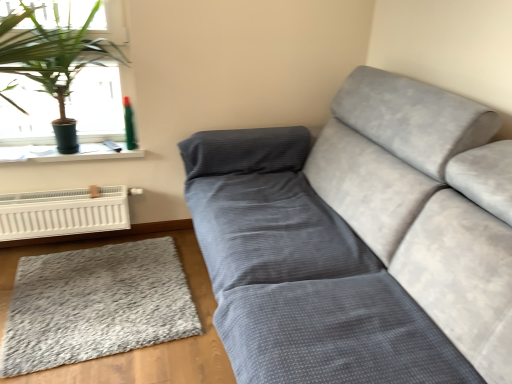
Question: Considering the relative positions of teal plastic spray can at upper left and green leafy plant at upper left in the image provided, is teal plastic spray can at upper left to the right of green leafy plant at upper left from the viewer's perspective?

Choices:
 (A) no
 (B) yes

Answer: (B)

Question: Does teal plastic spray can at upper left have a lesser height compared to green leafy plant at upper left?

Choices:
 (A) yes
 (B) no

Answer: (A)

Question: Is teal plastic spray can at upper left not inside green leafy plant at upper left?

Choices:
 (A) no
 (B) yes

Answer: (A)

Question: From a real-world perspective, is teal plastic spray can at upper left located higher than green leafy plant at upper left?

Choices:
 (A) yes
 (B) no

Answer: (B)

Question: Is teal plastic spray can at upper left oriented away from green leafy plant at upper left?

Choices:
 (A) yes
 (B) no

Answer: (A)

Question: Is gray shaggy rug at lower left taller or shorter than green leafy plant at upper left?

Choices:
 (A) short
 (B) tall

Answer: (A)

Question: Is point (7, 321) closer or farther from the camera than point (58, 84)?

Choices:
 (A) closer
 (B) farther

Answer: (A)

Question: Looking at their shapes, would you say gray shaggy rug at lower left is wider or thinner than green leafy plant at upper left?

Choices:
 (A) wide
 (B) thin

Answer: (A)

Question: Do you think gray shaggy rug at lower left is within green leafy plant at upper left, or outside of it?

Choices:
 (A) outside
 (B) inside

Answer: (A)

Question: Relative to gray shaggy rug at lower left, is teal plastic spray can at upper left in front or behind?

Choices:
 (A) behind
 (B) front

Answer: (A)

Question: Is teal plastic spray can at upper left to the left or to the right of gray shaggy rug at lower left in the image?

Choices:
 (A) left
 (B) right

Answer: (B)

Question: Looking at the image, does teal plastic spray can at upper left seem bigger or smaller compared to gray shaggy rug at lower left?

Choices:
 (A) big
 (B) small

Answer: (B)

Question: In terms of width, does teal plastic spray can at upper left look wider or thinner when compared to gray shaggy rug at lower left?

Choices:
 (A) thin
 (B) wide

Answer: (A)

Question: Visually, is white plastic heater at lower left positioned to the left or to the right of green leafy plant at upper left?

Choices:
 (A) right
 (B) left

Answer: (B)

Question: Is white plastic heater at lower left taller or shorter than green leafy plant at upper left?

Choices:
 (A) tall
 (B) short

Answer: (B)